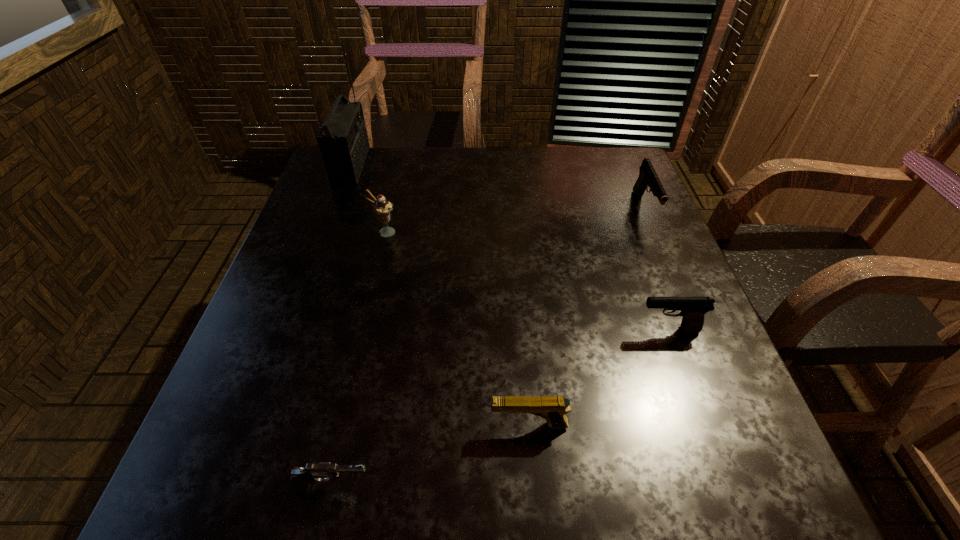
Locate an element on the screen. The image size is (960, 540). vacant space at the near right corner of the desktop is located at coordinates (747, 454).

This screenshot has height=540, width=960. I want to click on free area in between the icecream and the fourth object from left to right, so click(x=456, y=329).

What are the coordinates of `vacant space that is in between the farthest pistol and the farthest object` in the screenshot? It's located at (497, 187).

Find the location of `empty location between the leftmost object and the third farthest pistol`. empty location between the leftmost object and the third farthest pistol is located at coordinates (440, 295).

Where is `free spot between the second nearest object and the nearest object`? Image resolution: width=960 pixels, height=540 pixels. free spot between the second nearest object and the nearest object is located at coordinates (430, 455).

Find the location of a particular element. The width and height of the screenshot is (960, 540). vacant point located between the icecream and the third nearest object is located at coordinates (526, 281).

Locate an element on the screen. The height and width of the screenshot is (540, 960). free space between the fifth farthest object and the nearest object is located at coordinates (430, 455).

The height and width of the screenshot is (540, 960). Identify the location of free space between the farthest pistol and the radio receiver. (497, 187).

Find the location of a particular element. vacant area that lies between the fourth object from left to right and the icecream is located at coordinates (456, 329).

Where is `free space between the second pistol from left to right and the radio receiver`? This screenshot has height=540, width=960. free space between the second pistol from left to right and the radio receiver is located at coordinates (440, 295).